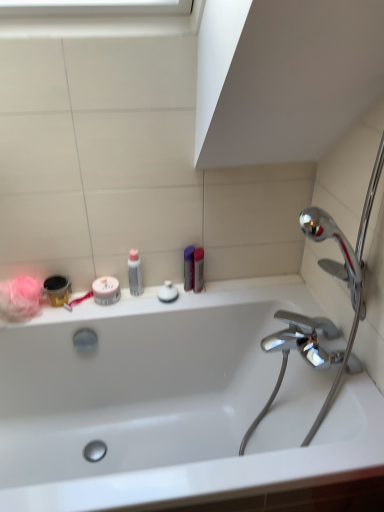
The width and height of the screenshot is (384, 512). I want to click on free space in front of white glossy soap at center, placed as the 2th toiletry when sorted from left to right, so click(x=162, y=310).